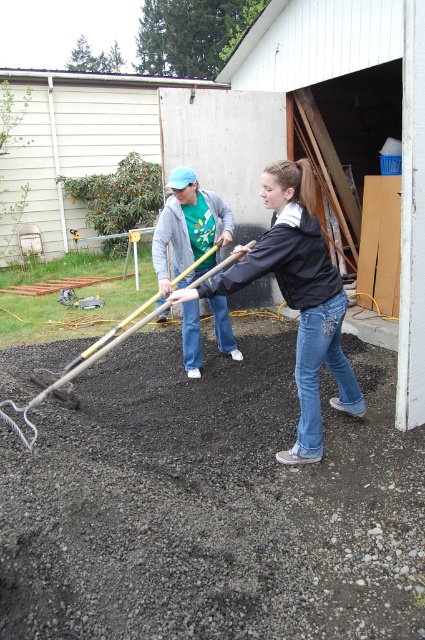
From the picture: You are a delivery person trying to place a small package between the denim jeans at center and the wooden handle rake at lower left. Can the package fit in the space between them?

The denim jeans at center is thinner than the wooden handle rake at lower left, so the space between them may be sufficient to fit the small package depending on the package dimensions.

You are a delivery person who needs to place a heavy box on the ground in the garden area shown. The denim jeans at center and the wooden handle rake at lower left are in the way. Which object must you move first to clear the space?

The denim jeans at center must be moved first because it is positioned over the wooden handle rake at lower left, meaning it is closer to the ground and blocking access to the area.